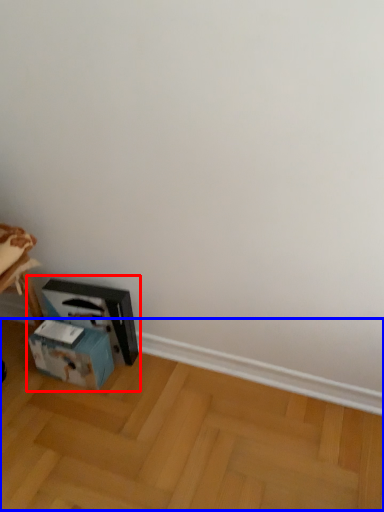
Question: Which object appears closest to the camera in this image, workbench (highlighted by a red box) or wood (highlighted by a blue box)?

Choices:
 (A) workbench
 (B) wood

Answer: (B)